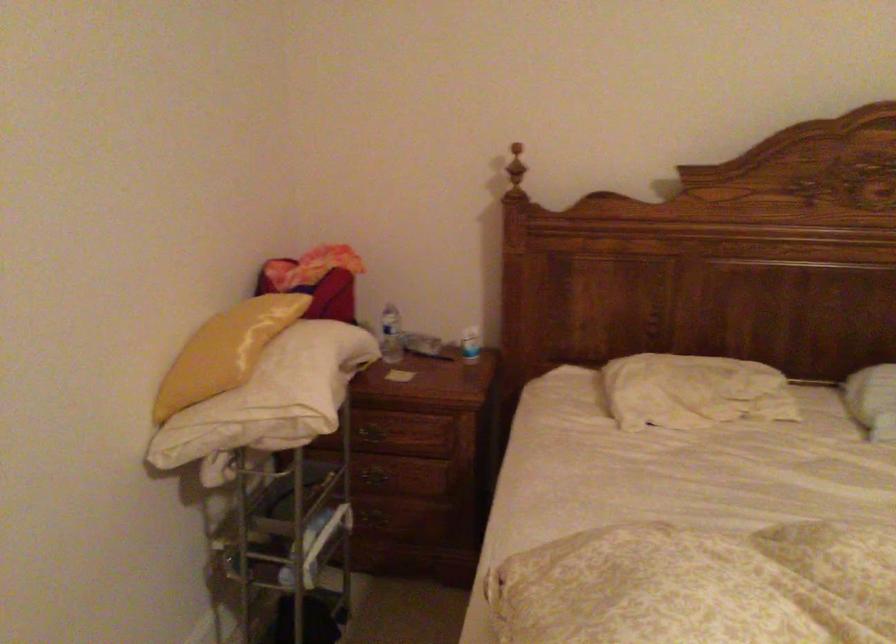
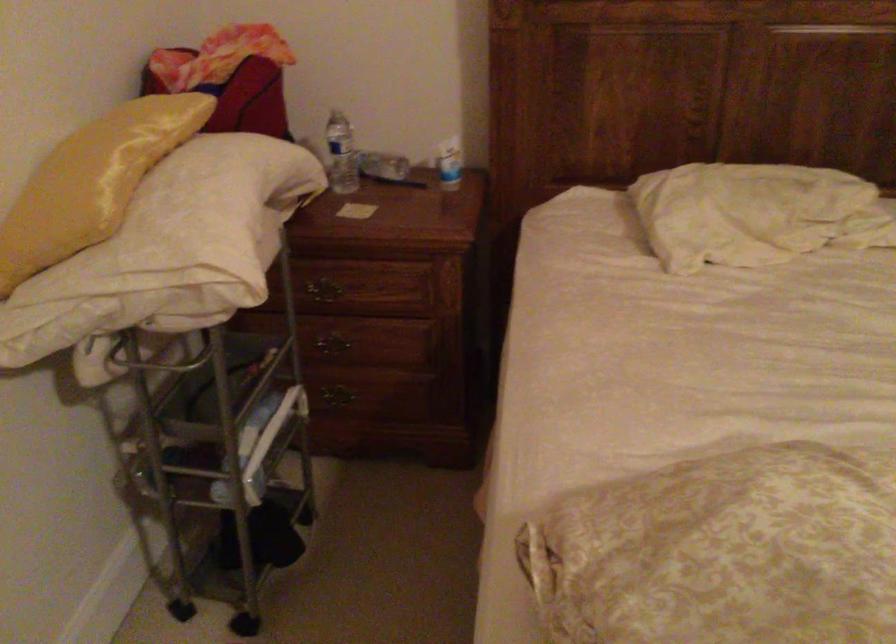
Question: The images are taken continuously from a first-person perspective. In which direction is your viewpoint rotating?

Choices:
 (A) Left
 (B) Right
 (C) Up
 (D) Down

Answer: (D)